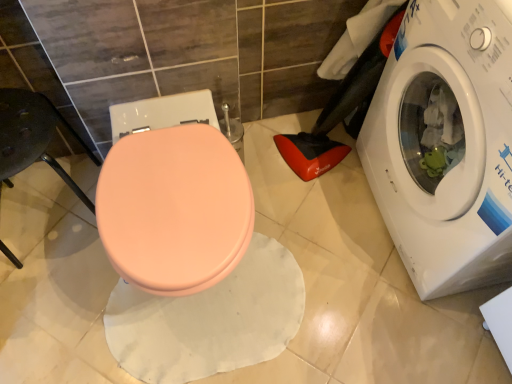
This screenshot has height=384, width=512. I want to click on vacant space that is to the left of matte pink bidet at center, so click(x=49, y=290).